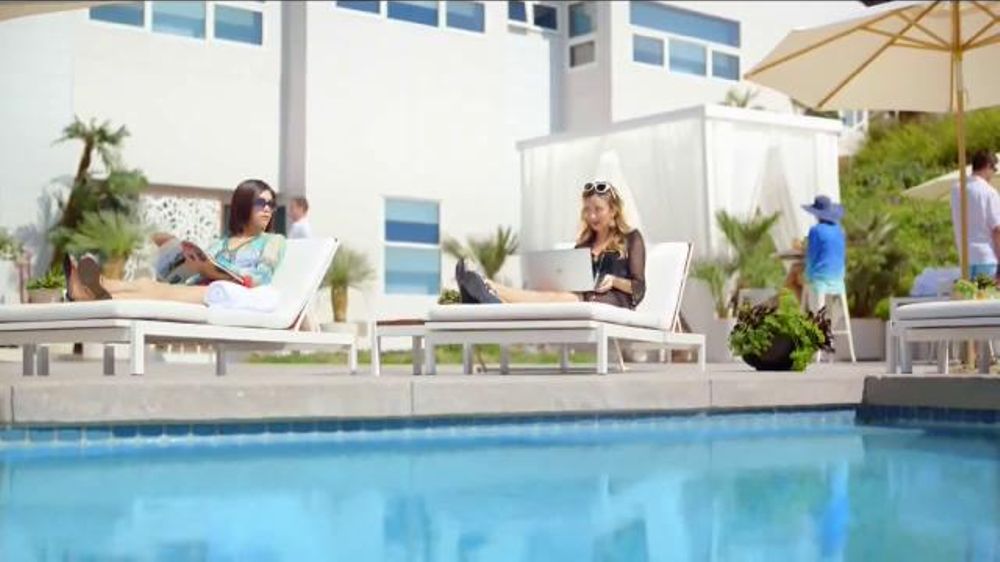
In order to click on laptop in this screenshot , I will do `click(551, 276)`.